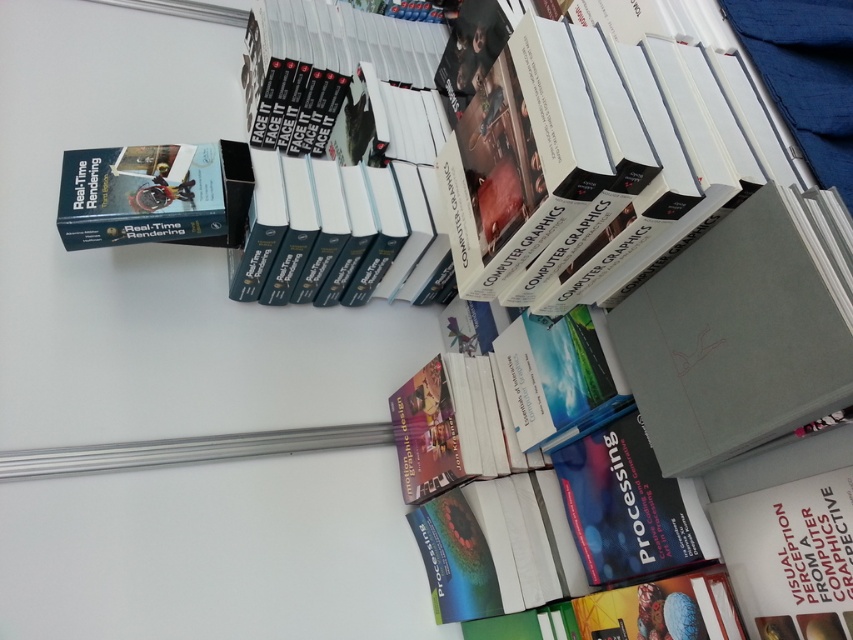
Is gray matte book at center-right thinner than hardcover book at upper left?

Indeed, gray matte book at center-right has a lesser width compared to hardcover book at upper left.

Can you confirm if gray matte book at center-right is shorter than hardcover book at upper left?

No, gray matte book at center-right is not shorter than hardcover book at upper left.

Find the location of a particular element. gray matte book at center-right is located at coordinates (732, 340).